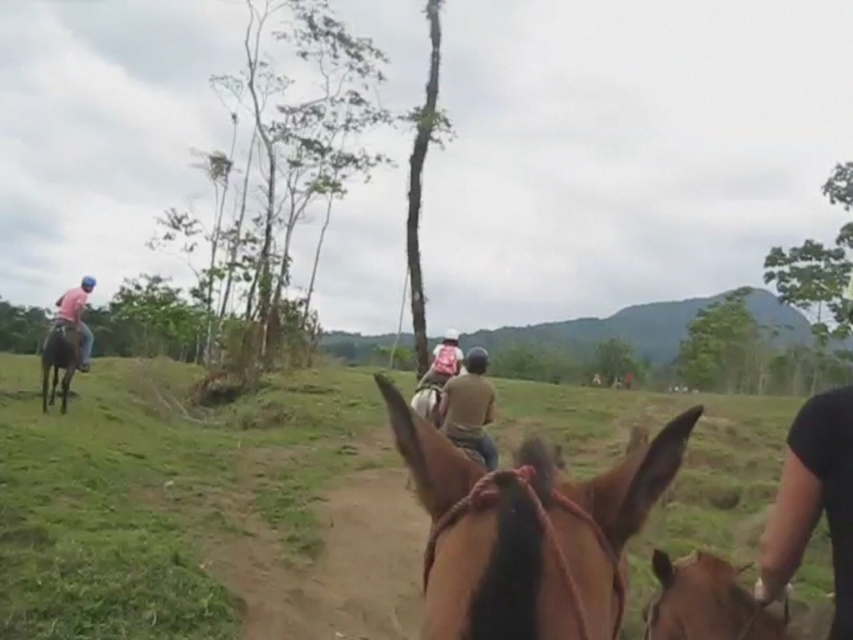
Question: Among these objects, which one is farthest from the camera?

Choices:
 (A) brown leather horse at lower right
 (B) brown leather horse at left
 (C) matte pink shirt at left
 (D) brown leather saddle at center

Answer: (B)

Question: Does brown glossy horse at center appear over matte pink shirt at left?

Choices:
 (A) yes
 (B) no

Answer: (B)

Question: Is brown leather horse at lower right below brown leather saddle at center?

Choices:
 (A) no
 (B) yes

Answer: (A)

Question: Which point is closer to the camera?

Choices:
 (A) (54, 326)
 (B) (425, 387)
 (C) (730, 596)
 (D) (45, 339)

Answer: (C)

Question: Is matte pink shirt at left wider than brown leather saddle at center?

Choices:
 (A) no
 (B) yes

Answer: (B)

Question: Which object appears farthest from the camera in this image?

Choices:
 (A) brown leather horse at lower right
 (B) brown leather saddle at center
 (C) matte pink shirt at left

Answer: (C)